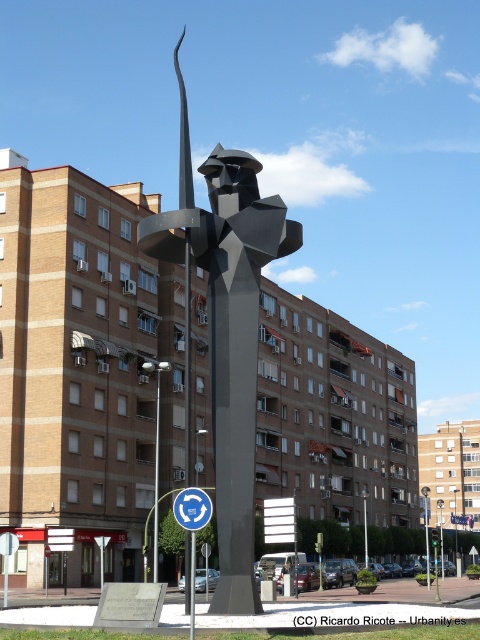
Question: Which of the following is the farthest from the observer?

Choices:
 (A) blue circular sign at center
 (B) polished steel sculpture at center

Answer: (B)

Question: Is polished steel sculpture at center closer to the viewer compared to blue circular sign at center?

Choices:
 (A) no
 (B) yes

Answer: (A)

Question: Among these objects, which one is nearest to the camera?

Choices:
 (A) blue circular sign at center
 (B) polished steel sculpture at center

Answer: (A)

Question: Is polished steel sculpture at center wider than blue circular sign at center?

Choices:
 (A) yes
 (B) no

Answer: (A)

Question: Does polished steel sculpture at center appear over blue circular sign at center?

Choices:
 (A) yes
 (B) no

Answer: (A)